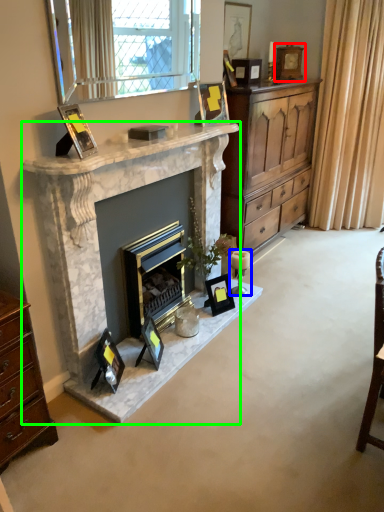
Question: Which is farther away from picture frame (highlighted by a red box)? candle holder (highlighted by a blue box) or fireplace (highlighted by a green box)?

Choices:
 (A) candle holder
 (B) fireplace

Answer: (B)